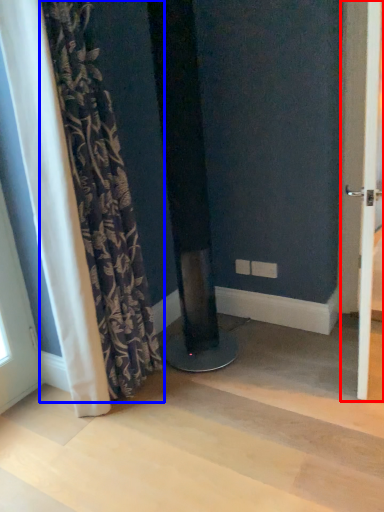
Question: Which object appears farthest to the camera in this image, screen door (highlighted by a red box) or curtain (highlighted by a blue box)?

Choices:
 (A) screen door
 (B) curtain

Answer: (B)